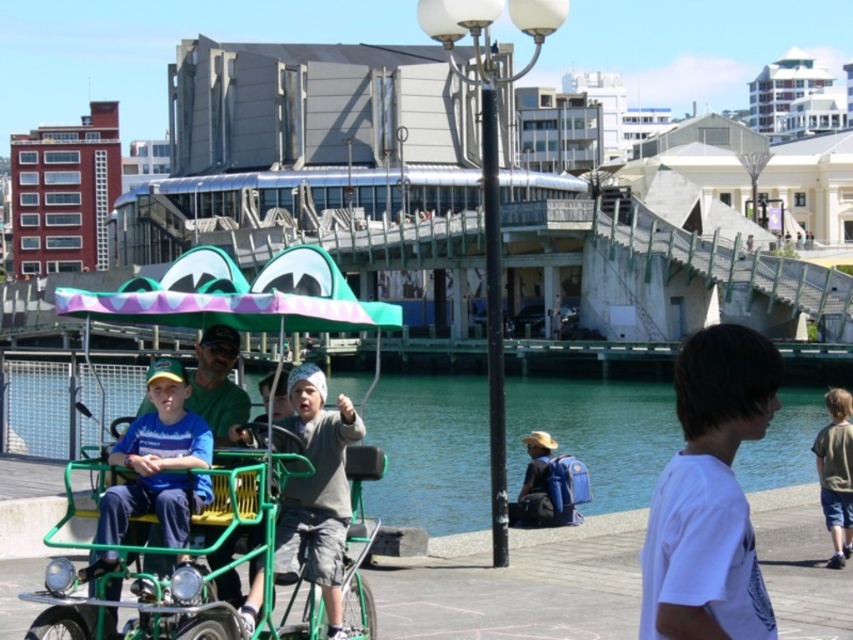
Which is behind, point (782, 394) or point (325, 545)?

The point (782, 394) is behind.

Can you confirm if green metallic water at center is shorter than gray cotton shirt at center?

No.

Which is in front, point (467, 458) or point (334, 525)?

Positioned in front is point (334, 525).

Locate an element on the screen. green metallic water at center is located at coordinates (431, 451).

Who is more distant from viewer, (114, 636) or (341, 508)?

The point (341, 508) is behind.

Who is shorter, green matte tricycle at center or gray cotton shirt at center?

With less height is gray cotton shirt at center.

The width and height of the screenshot is (853, 640). What do you see at coordinates (172, 513) in the screenshot? I see `green matte tricycle at center` at bounding box center [172, 513].

This screenshot has height=640, width=853. I want to click on green matte tricycle at center, so [x=172, y=513].

What are the coordinates of `green matte tricycle at center` in the screenshot? It's located at (172, 513).

Consider the image. Can you confirm if green matte tricycle at center is bigger than white matte shirt at lower right?

Yes, green matte tricycle at center is bigger than white matte shirt at lower right.

Describe the element at coordinates (172, 513) in the screenshot. I see `green matte tricycle at center` at that location.

Image resolution: width=853 pixels, height=640 pixels. Find the location of `green matte tricycle at center`. green matte tricycle at center is located at coordinates (172, 513).